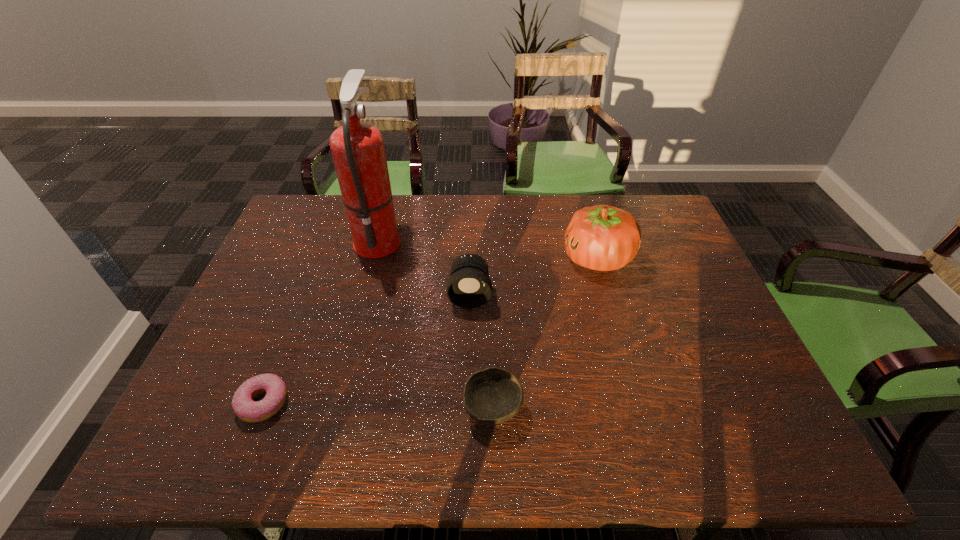
I want to click on object that is at the near left corner, so click(x=244, y=407).

Locate an element on the screen. This screenshot has height=540, width=960. vacant space at the far edge of the desktop is located at coordinates (485, 233).

The height and width of the screenshot is (540, 960). In order to click on free spot at the near edge of the desktop in this screenshot , I will do `click(344, 430)`.

This screenshot has width=960, height=540. Identify the location of vacant space at the left edge of the desktop. (255, 323).

In order to click on vacant space at the right edge in this screenshot , I will do `click(665, 286)`.

Where is `free space between the fourth tallest object and the telephoto lens`? This screenshot has width=960, height=540. free space between the fourth tallest object and the telephoto lens is located at coordinates (x=481, y=351).

Locate an element on the screen. free space between the fire extinguisher and the leftmost object is located at coordinates (321, 321).

You are a GUI agent. You are given a task and a screenshot of the screen. Output one action in this format:
    pyautogui.click(x=<x>, y=<y>)
    Task: Click on the free spot between the second shortest object and the pumpkin
    
    Given the screenshot: What is the action you would take?
    pyautogui.click(x=545, y=333)

Where is `free space between the pumpkin and the tallest object`? The width and height of the screenshot is (960, 540). free space between the pumpkin and the tallest object is located at coordinates (488, 248).

I want to click on vacant space in between the pumpkin and the fourth tallest object, so click(x=545, y=333).